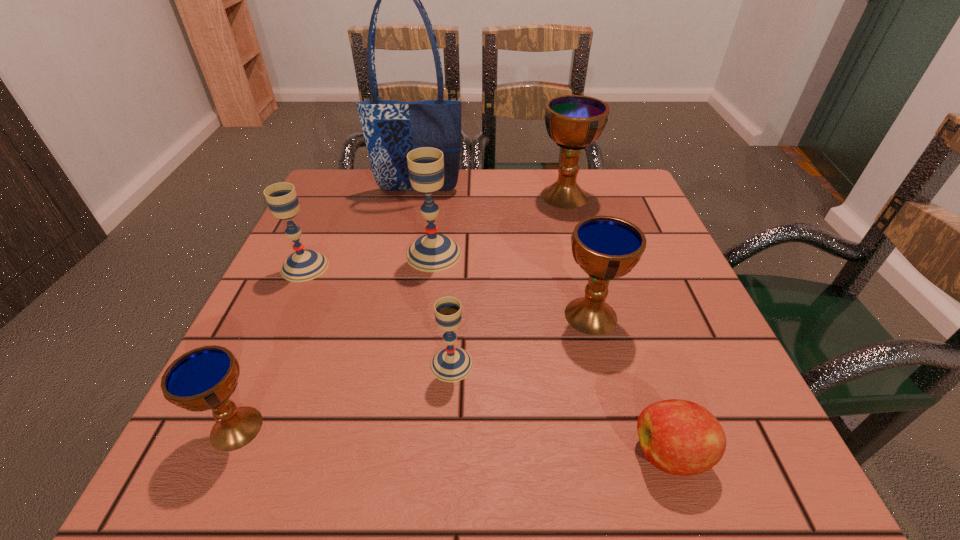
What are the coordinates of `the nearest gray chalice` in the screenshot? It's located at (450, 364).

Locate an element on the screen. the shortest object is located at coordinates (679, 437).

The height and width of the screenshot is (540, 960). What are the coordinates of `apple` in the screenshot? It's located at (679, 437).

Locate an element on the screen. vacant space situated on the front-facing side of the tallest object is located at coordinates (414, 213).

Image resolution: width=960 pixels, height=540 pixels. Identify the location of free space located 0.250m on the front of the farthest blue chalice. (588, 283).

At what (x,y) coordinates should I click in order to perform the action: click on vacant space located on the left of the biggest gray chalice. Please return your answer as a coordinate pair (x, y). The height and width of the screenshot is (540, 960). Looking at the image, I should click on (353, 254).

At what (x,y) coordinates should I click in order to perform the action: click on free space located 0.170m on the back of the second farthest blue chalice. Please return your answer as a coordinate pair (x, y). This screenshot has width=960, height=540. Looking at the image, I should click on (571, 239).

You are a GUI agent. You are given a task and a screenshot of the screen. Output one action in this format:
    pyautogui.click(x=<x>, y=<y>)
    Task: Click on the blank space located on the right of the second smallest gray chalice
    The image size is (960, 540).
    Given the screenshot: What is the action you would take?
    pyautogui.click(x=352, y=267)

Where is `blank space located 0.340m on the back of the nearest blue chalice`? blank space located 0.340m on the back of the nearest blue chalice is located at coordinates (312, 259).

Where is `free spot located 0.320m on the right of the second nearest chalice`? free spot located 0.320m on the right of the second nearest chalice is located at coordinates [670, 364].